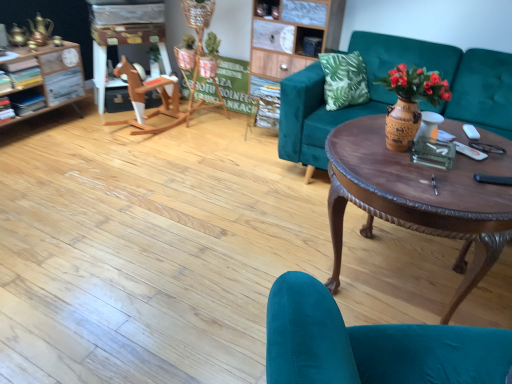
Question: Does brown polished wood coffee table at center have a lesser width compared to teal velvet couch at center?

Choices:
 (A) no
 (B) yes

Answer: (B)

Question: Is brown polished wood coffee table at center oriented towards teal velvet couch at center?

Choices:
 (A) yes
 (B) no

Answer: (B)

Question: Considering the relative positions of brown polished wood coffee table at center and teal velvet couch at center in the image provided, is brown polished wood coffee table at center to the right of teal velvet couch at center from the viewer's perspective?

Choices:
 (A) no
 (B) yes

Answer: (A)

Question: From a real-world perspective, is brown polished wood coffee table at center physically below teal velvet couch at center?

Choices:
 (A) no
 (B) yes

Answer: (B)

Question: Can you confirm if brown polished wood coffee table at center is wider than teal velvet couch at center?

Choices:
 (A) yes
 (B) no

Answer: (B)

Question: Can you confirm if brown polished wood coffee table at center is smaller than teal velvet couch at center?

Choices:
 (A) yes
 (B) no

Answer: (A)

Question: Is teal velvet couch at center closer to the viewer compared to wooden rocking horse at left?

Choices:
 (A) yes
 (B) no

Answer: (A)

Question: Is teal velvet couch at center at the right side of wooden rocking horse at left?

Choices:
 (A) yes
 (B) no

Answer: (A)

Question: Can you confirm if teal velvet couch at center is smaller than wooden rocking horse at left?

Choices:
 (A) no
 (B) yes

Answer: (A)

Question: Considering the relative sizes of teal velvet couch at center and wooden rocking horse at left in the image provided, is teal velvet couch at center thinner than wooden rocking horse at left?

Choices:
 (A) yes
 (B) no

Answer: (B)

Question: Is teal velvet couch at center to the left of wooden rocking horse at left from the viewer's perspective?

Choices:
 (A) yes
 (B) no

Answer: (B)

Question: Considering the relative sizes of teal velvet couch at center and wooden rocking horse at left in the image provided, is teal velvet couch at center bigger than wooden rocking horse at left?

Choices:
 (A) yes
 (B) no

Answer: (A)

Question: Are teal velvet chair at lower right and green cardboard sign at center far apart?

Choices:
 (A) no
 (B) yes

Answer: (B)